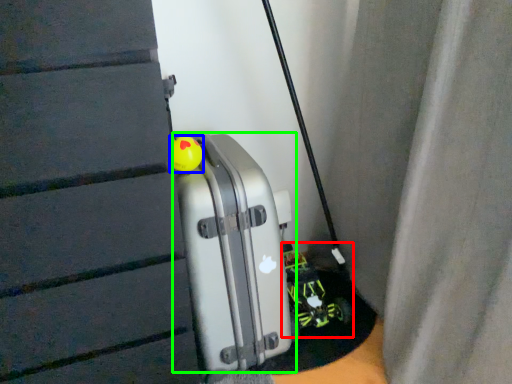
Question: Estimate the real-world distances between objects in this image. Which object is farther from toy car (highlighted by a red box), toy (highlighted by a blue box) or luggage (highlighted by a green box)?

Choices:
 (A) toy
 (B) luggage

Answer: (A)